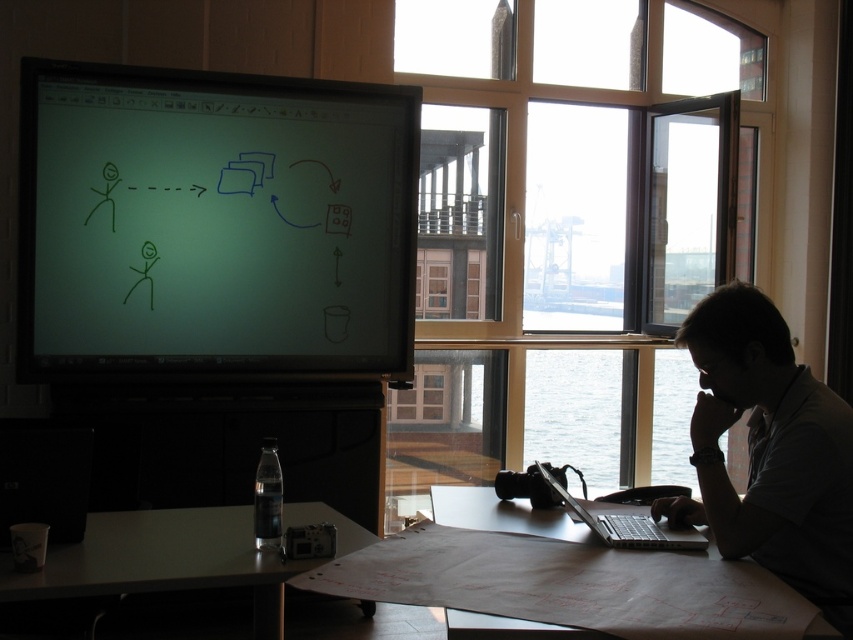
You are a photographer setting up a shoot in this workspace. You want to place a tripod 2 meters away from the matte green screen at upper left to capture a clear background. Is this possible without moving the existing furniture?

The matte green screen at upper left is 3.17 meters away from the camera. Placing the tripod 2 meters away from it would require positioning it at 1.17 meters from the camera, which should be feasible unless there are obstacles not mentioned in the scene description.

Based on the photo, you are an office worker who wants to look at the waterfront view outside while working. You have a dark gray shirt at right and a transparent glass window at center. Which object should you look through to see the waterfront view?

You should look through the transparent glass window at center to see the waterfront view because it is a window and the dark gray shirt at right is an article of clothing, not a view.

You are trying to reach for the transparent glass window at center to open it, but there is a silver metallic laptop at lower right in the way. Can you move the laptop out of the way to access the window?

The silver metallic laptop at lower right is closer to the viewer than the transparent glass window at center, so you can move the laptop to access the window.